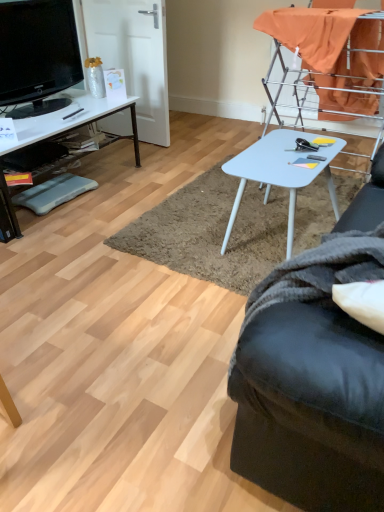
Find the location of a particular element. Image resolution: width=384 pixels, height=512 pixels. vacant region to the left of black plastic pen at left is located at coordinates (42, 117).